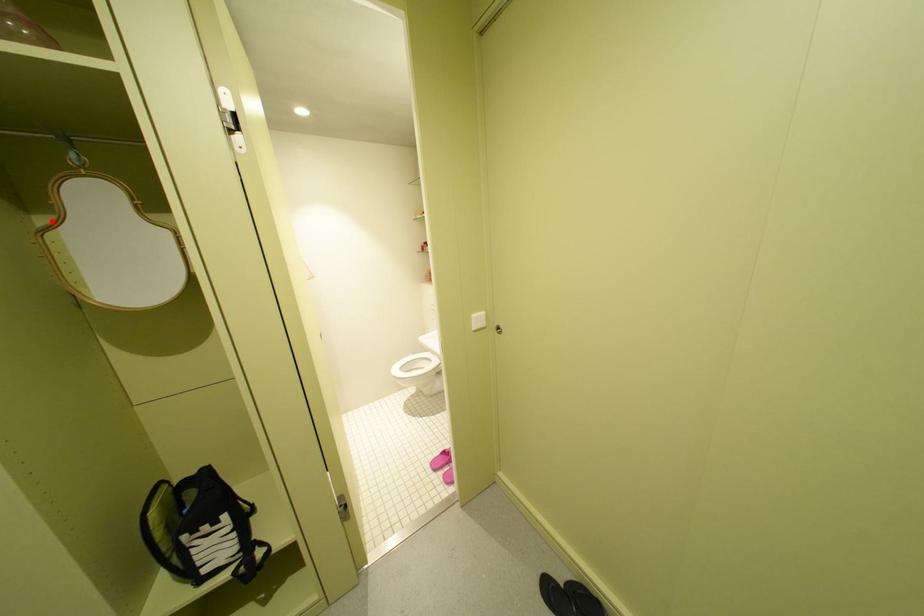
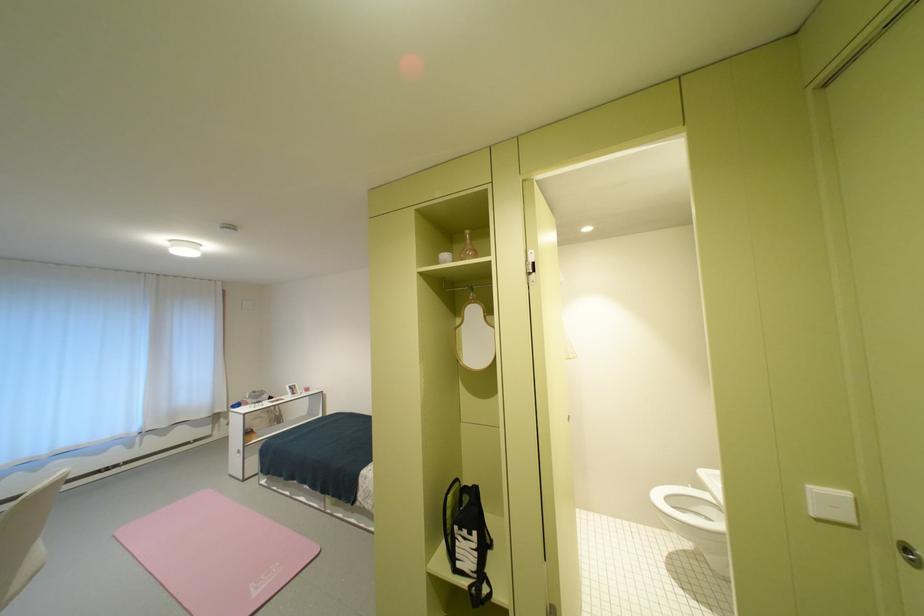
In the second image, find the point that corresponds to the highlighted location in the first image.

(468, 322)